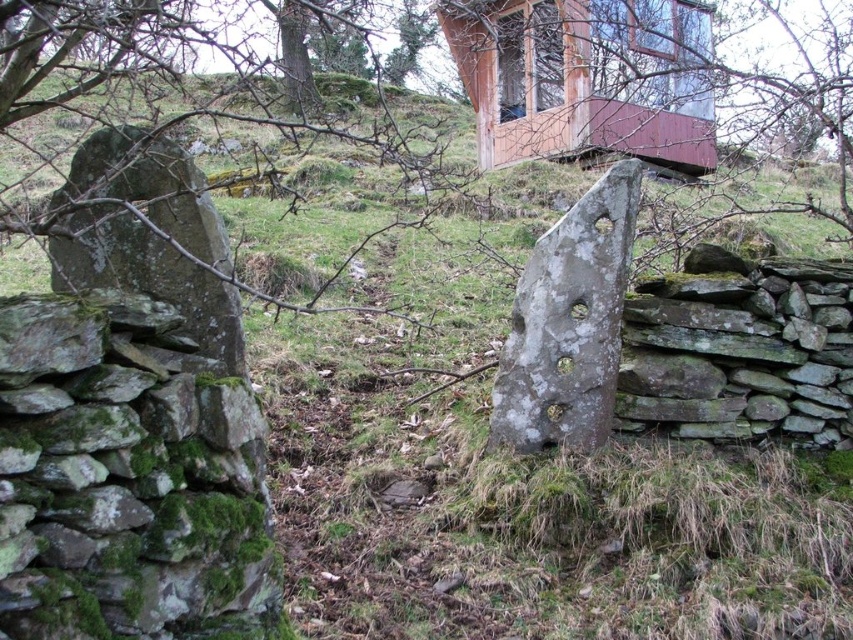
Question: Does wooden hut at upper center come in front of gray stone at center?

Choices:
 (A) no
 (B) yes

Answer: (A)

Question: Observing the image, what is the correct spatial positioning of wooden hut at upper center in reference to gray stone at center?

Choices:
 (A) above
 (B) below

Answer: (A)

Question: Which point is farther to the camera?

Choices:
 (A) (444, 20)
 (B) (614, 355)

Answer: (A)

Question: Among these objects, which one is nearest to the camera?

Choices:
 (A) gray stone at center
 (B) wooden hut at upper center

Answer: (A)

Question: Is wooden hut at upper center to the right of gray stone at center from the viewer's perspective?

Choices:
 (A) yes
 (B) no

Answer: (A)